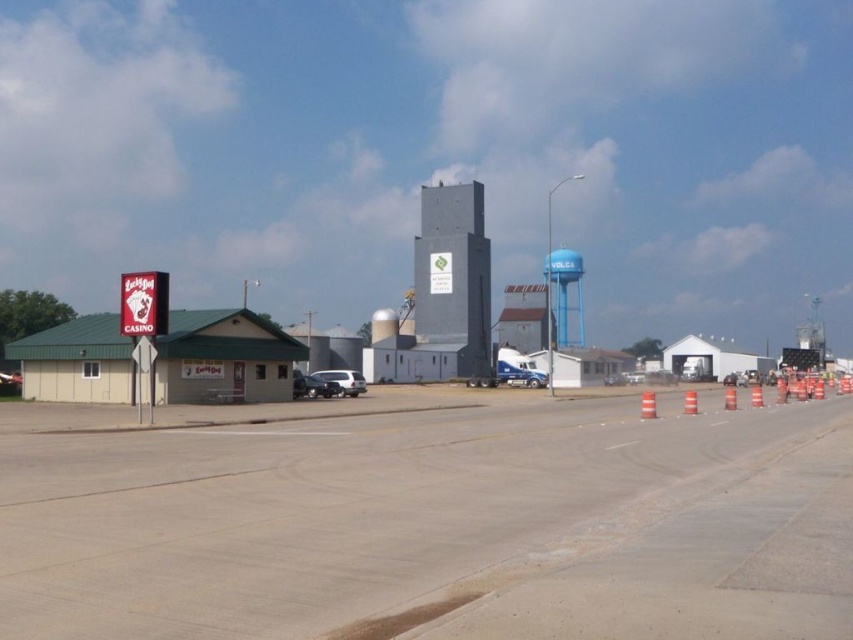
Question: Does metallic silver sedan at center appear over orange reflective cone at center-right?

Choices:
 (A) yes
 (B) no

Answer: (A)

Question: Which point is farther to the camera?

Choices:
 (A) orange reflective plastic traffic cone at center-right
 (B) satin silver suv at center

Answer: (B)

Question: Can you confirm if metallic silver sedan at center is positioned to the left of satin silver suv at center?

Choices:
 (A) no
 (B) yes

Answer: (A)

Question: Can you confirm if smooth asphalt road at center is positioned to the left of orange reflective cone at center-right?

Choices:
 (A) yes
 (B) no

Answer: (A)

Question: Which object is the closest to the satin silver suv at center?

Choices:
 (A) blue painted water tower at center right
 (B) orange reflective cone at center-right

Answer: (B)

Question: Which of these objects is positioned closest to the metallic silver sedan at center?

Choices:
 (A) satin silver suv at center
 (B) orange reflective plastic traffic cone at center-right
 (C) blue painted water tower at center right
 (D) orange reflective cone at center-right

Answer: (A)